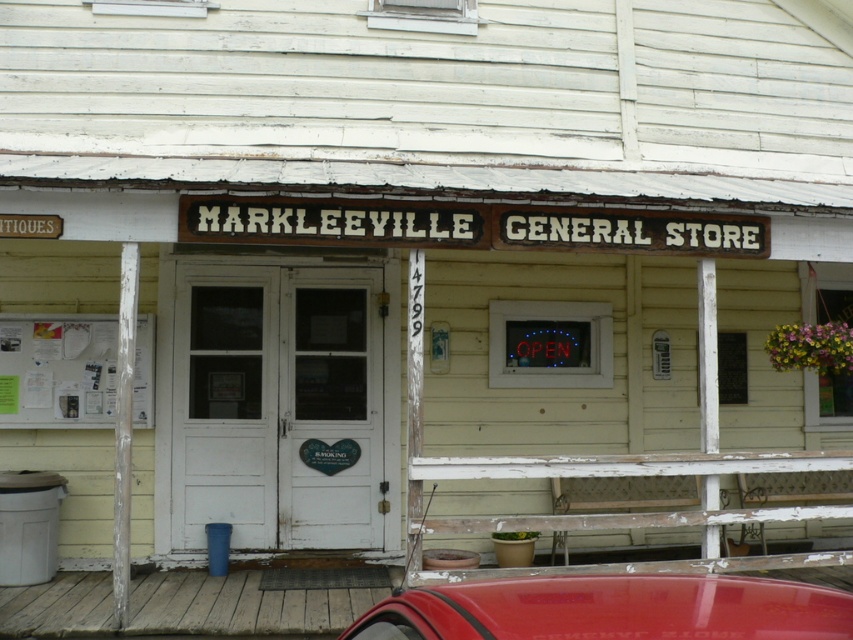
Question: Does shiny red car at lower center appear on the left side of white paperboard at left?

Choices:
 (A) no
 (B) yes

Answer: (A)

Question: Which of the following is the closest to the observer?

Choices:
 (A) shiny red car at lower center
 (B) white paperboard at left

Answer: (A)

Question: Observing the image, what is the correct spatial positioning of shiny red car at lower center in reference to white paperboard at left?

Choices:
 (A) left
 (B) right

Answer: (B)

Question: Is shiny red car at lower center wider than white paperboard at left?

Choices:
 (A) yes
 (B) no

Answer: (A)